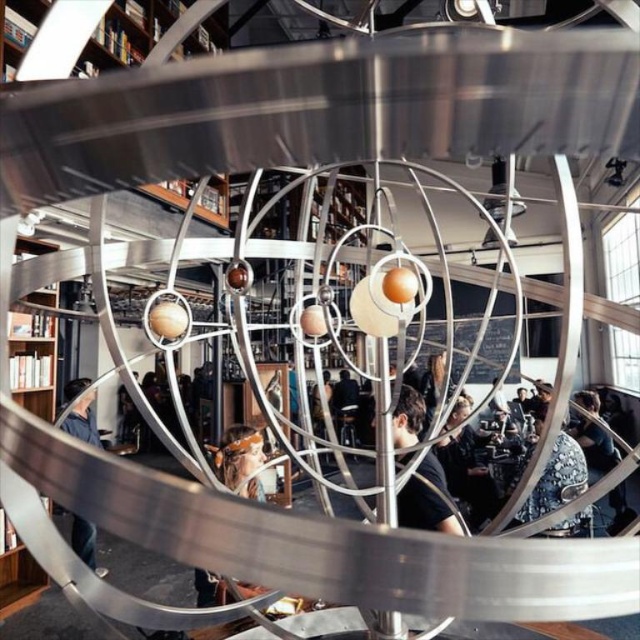
You are standing in front of the metal sculpture and want to take a photo. There are two points on the sculpture marked as point 1 at coordinates point (404, 436) and point 2 at coordinates point (93, 392). Which point will appear larger in your photo?

Point 1 at coordinates point (404, 436) will appear larger in the photo because it is closer to the camera than point 2 at coordinates point (93, 392).

You are standing in front of the sculpture and want to place your denim jacket on the nearest available surface. Which object should you choose between the brown wooden bookshelf at left and the denim jacket at lower left?

The denim jacket at lower left is the correct choice because it is closer to you than the brown wooden bookshelf at left, which is positioned further away.

You are an artist planning to paint the scene. You need to decide the placement of shadows for the matte black shirt at center and the denim jacket at lower left. Based on their positions, which object should cast a shadow on the other?

The matte black shirt at center is above the denim jacket at lower left, so its shadow would cast downward onto the denim jacket at lower left.